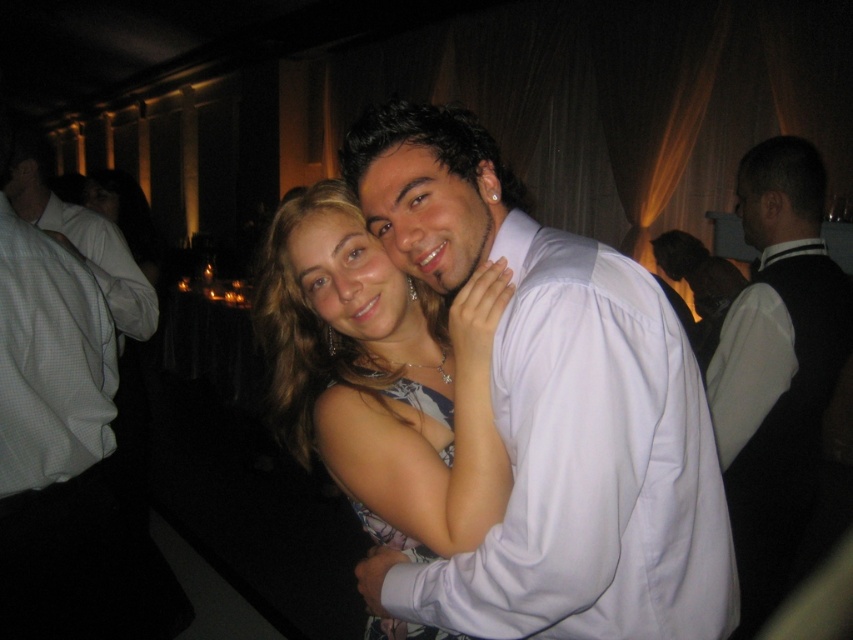
Question: Is white checkered shirt at left further to the viewer compared to floral print fabric dress at center?

Choices:
 (A) no
 (B) yes

Answer: (B)

Question: Can you confirm if matte silver necklace at center is bigger than black velvet vest at right?

Choices:
 (A) no
 (B) yes

Answer: (B)

Question: Which of the following is the farthest from the observer?

Choices:
 (A) (340, 477)
 (B) (585, 540)

Answer: (A)

Question: Among these objects, which one is nearest to the camera?

Choices:
 (A) white satin shirt at center
 (B) floral print fabric dress at center
 (C) matte silver necklace at center

Answer: (A)

Question: Does white satin shirt at center appear under white checkered shirt at left?

Choices:
 (A) no
 (B) yes

Answer: (B)

Question: Among these points, which one is nearest to the camera?

Choices:
 (A) (384, 497)
 (B) (804, 515)
 (C) (398, 625)
 (D) (672, 316)

Answer: (D)